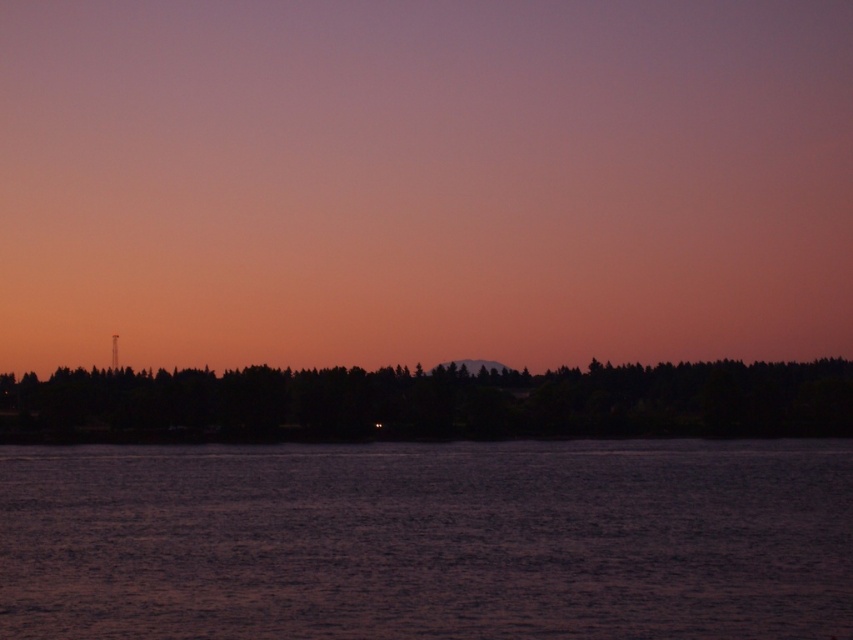
Question: Is the position of dark purple water at center more distant than that of dark green trees at center?

Choices:
 (A) yes
 (B) no

Answer: (B)

Question: Which point appears closest to the camera in this image?

Choices:
 (A) (677, 602)
 (B) (817, 387)

Answer: (A)

Question: Where is dark purple water at center located in relation to dark green trees at center in the image?

Choices:
 (A) above
 (B) below

Answer: (B)

Question: Which point is closer to the camera?

Choices:
 (A) (73, 404)
 (B) (544, 520)

Answer: (B)

Question: Is dark purple water at center thinner than dark green trees at center?

Choices:
 (A) no
 (B) yes

Answer: (B)